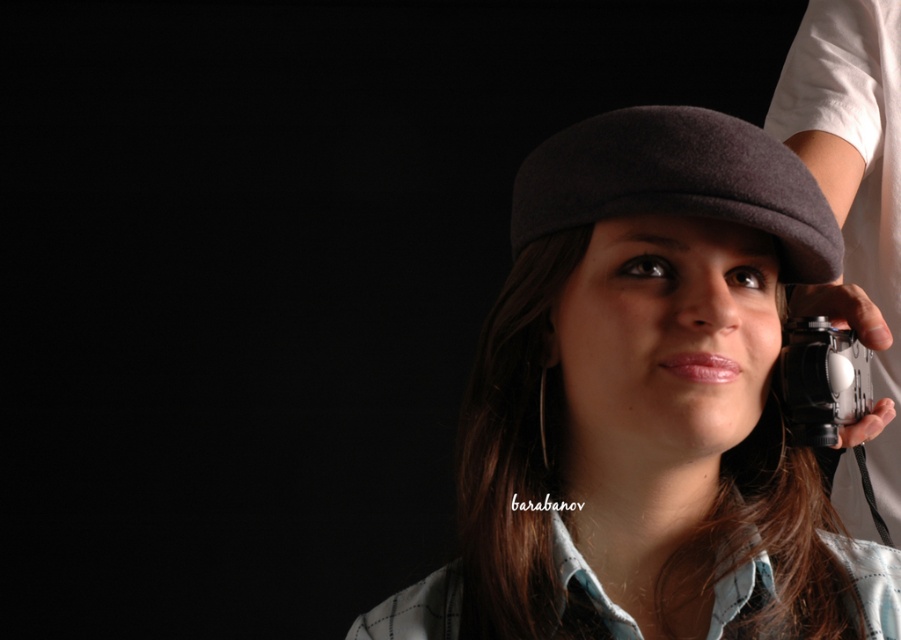
Question: Is black matte camera at right smaller than black plastic camera at right?

Choices:
 (A) yes
 (B) no

Answer: (B)

Question: Which of the following is the farthest from the observer?

Choices:
 (A) black matte camera at right
 (B) dark woolen hat at center
 (C) black plastic camera at right

Answer: (A)

Question: Which of the following is the closest to the observer?

Choices:
 (A) (895, 536)
 (B) (781, 170)
 (C) (593, 620)

Answer: (C)

Question: Which point is closer to the camera?

Choices:
 (A) (670, 198)
 (B) (838, 406)
 (C) (872, 460)

Answer: (A)

Question: Can you confirm if matte gray beret at center is positioned to the left of dark woolen hat at center?

Choices:
 (A) no
 (B) yes

Answer: (A)

Question: Is black matte camera at right to the right of black plastic camera at right from the viewer's perspective?

Choices:
 (A) yes
 (B) no

Answer: (A)